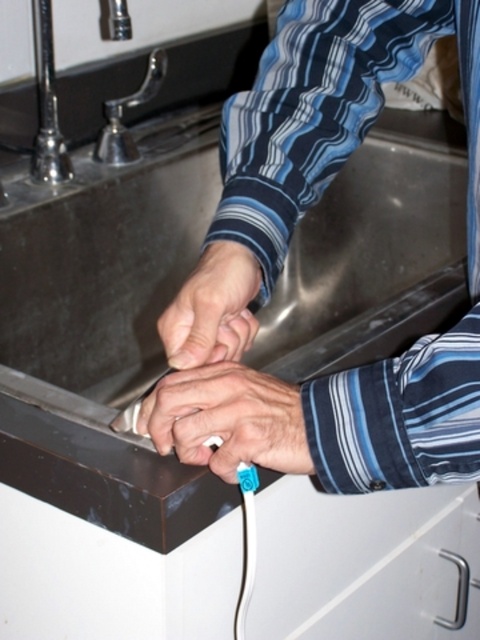
Is smooth skin hand at center in front of polished chrome faucet at upper left?

Yes.

Where is `smooth skin hand at center`? smooth skin hand at center is located at coordinates coord(213,308).

Is blue striped shirt at center below polished chrome faucet at upper left?

Yes, blue striped shirt at center is below polished chrome faucet at upper left.

Which is in front, point (412, 410) or point (49, 51)?

Positioned in front is point (412, 410).

Is point (350, 387) closer to viewer compared to point (48, 81)?

That is True.

Locate an element on the screen. The height and width of the screenshot is (640, 480). blue striped shirt at center is located at coordinates pyautogui.click(x=286, y=252).

Can you confirm if blue striped shirt at center is positioned below smooth skin hand at center?

Actually, blue striped shirt at center is above smooth skin hand at center.

This screenshot has width=480, height=640. What do you see at coordinates (286, 252) in the screenshot? I see `blue striped shirt at center` at bounding box center [286, 252].

At what (x,y) coordinates should I click in order to perform the action: click on blue striped shirt at center. Please return your answer as a coordinate pair (x, y). The width and height of the screenshot is (480, 640). Looking at the image, I should click on (286, 252).